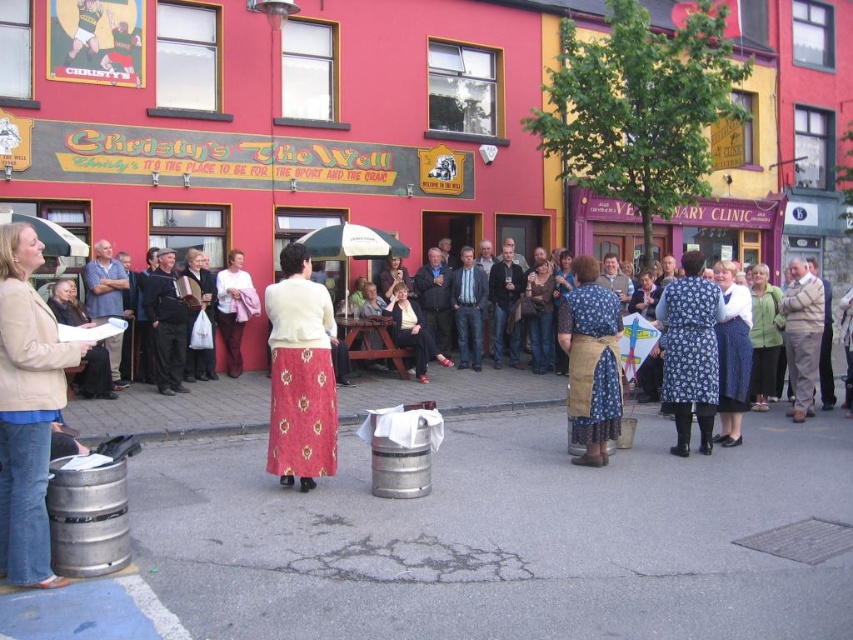
You are a photographer trying to capture both the blue floral dress at center and the light beige sweater at center in a single shot. Since you want to emphasize the size difference between them, which one should you position closer to the camera?

To emphasize the size difference between the blue floral dress at center and the light beige sweater at center, position the blue floral dress at center closer to the camera since it is bigger than the light beige sweater at center.

You are a photographer positioned in front of the building and want to capture both the blue floral dress at center and the light beige sweater at center in your shot. Which one will appear larger in the photo?

The blue floral dress at center will appear larger in the photo because it is closer to the viewer than the light beige sweater at center.

You are standing at the point marked as point (x=750, y=356) in the image. You want to take a photo of the women and the keg without moving them. Can you step back 30 feet to get a better shot?

The distance of point (x=750, y=356) from camera is 28.65 feet. If you step back 30 feet, you would be 28.65 feet plus 30 feet away, which is 58.65 feet from the point. However, since the women and keg are at that point, stepping back would move you further away from them, making them appear smaller in the photo. To get a better shot, you might need to adjust your angle or use a zoom lens instead of moving back.